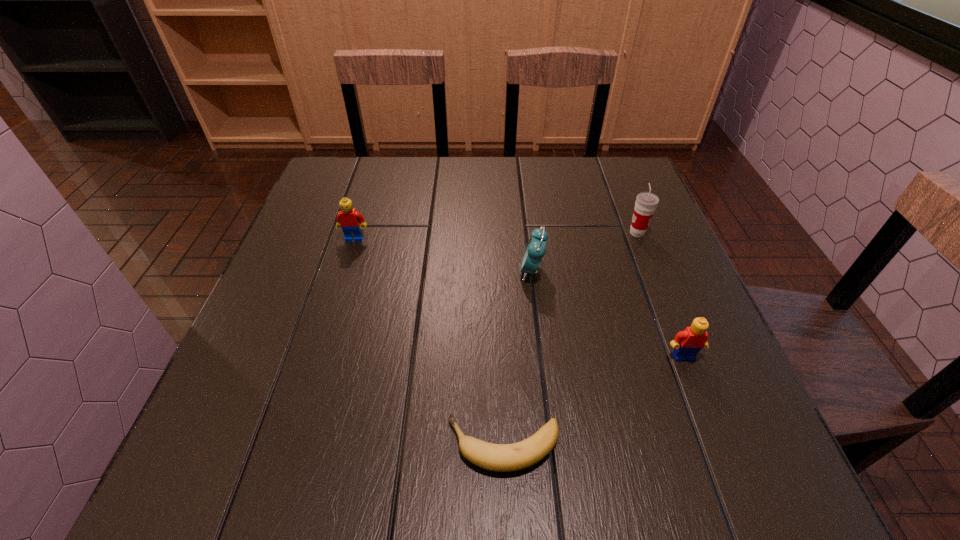
Find the location of a particular element. This screenshot has height=540, width=960. object positioned at the left edge is located at coordinates (351, 221).

You are a GUI agent. You are given a task and a screenshot of the screen. Output one action in this format:
    pyautogui.click(x=<x>, y=<y>)
    Task: Click on the cup at the right edge
    
    Given the screenshot: What is the action you would take?
    pyautogui.click(x=646, y=203)

Image resolution: width=960 pixels, height=540 pixels. I want to click on Lego at the right edge, so click(x=686, y=344).

This screenshot has width=960, height=540. I want to click on blank space at the far edge of the desktop, so click(x=454, y=185).

Where is `free point at the near edge`? The image size is (960, 540). free point at the near edge is located at coordinates (420, 444).

Image resolution: width=960 pixels, height=540 pixels. Identify the location of vacant space at the left edge of the desktop. (264, 322).

I want to click on vacant area at the right edge, so click(747, 413).

In the image, there is a desktop. Identify the location of vacant space at the far left corner. Image resolution: width=960 pixels, height=540 pixels. (364, 186).

The width and height of the screenshot is (960, 540). In the image, there is a desktop. Find the location of `vacant space at the far right corner`. vacant space at the far right corner is located at coordinates (600, 161).

The height and width of the screenshot is (540, 960). In order to click on unoccupied area between the third nearest object and the tallest object in this screenshot , I will do `click(585, 252)`.